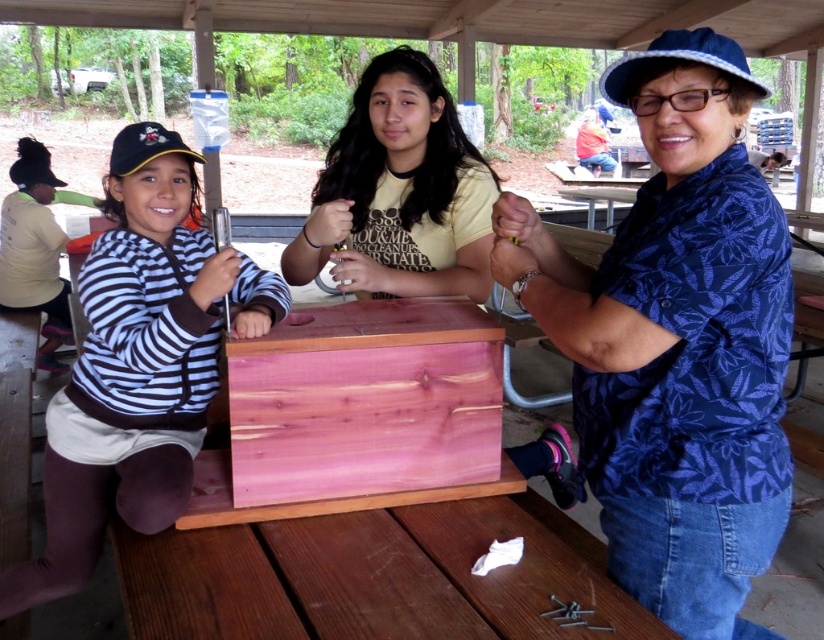
Locate an element on the screen. The height and width of the screenshot is (640, 824). blue floral shirt at center is located at coordinates (677, 342).

Is blue floral shirt at center to the right of yellow t-shirt at center from the viewer's perspective?

Yes, blue floral shirt at center is to the right of yellow t-shirt at center.

Who is more distant from viewer, (588,365) or (305,269)?

Point (305,269)

Locate an element on the screen. blue floral shirt at center is located at coordinates (677, 342).

Which is more to the right, blue floral shirt at center or cedar wood crate at center?

blue floral shirt at center

Can you confirm if blue floral shirt at center is positioned to the left of cedar wood crate at center?

Incorrect, blue floral shirt at center is not on the left side of cedar wood crate at center.

Who is more forward, (780,282) or (232,461)?

Point (780,282)

At what (x,y) coordinates should I click in order to perform the action: click on blue floral shirt at center. Please return your answer as a coordinate pair (x, y). This screenshot has height=640, width=824. Looking at the image, I should click on pyautogui.click(x=677, y=342).

Measure the distance between cedar wood crate at center and yellow t-shirt at center.

cedar wood crate at center and yellow t-shirt at center are 11.61 inches apart.

Does point (286, 358) come behind point (448, 132)?

That is False.

Which is behind, point (487, 374) or point (307, 275)?

The point (307, 275) is behind.

This screenshot has height=640, width=824. I want to click on cedar wood crate at center, so click(364, 401).